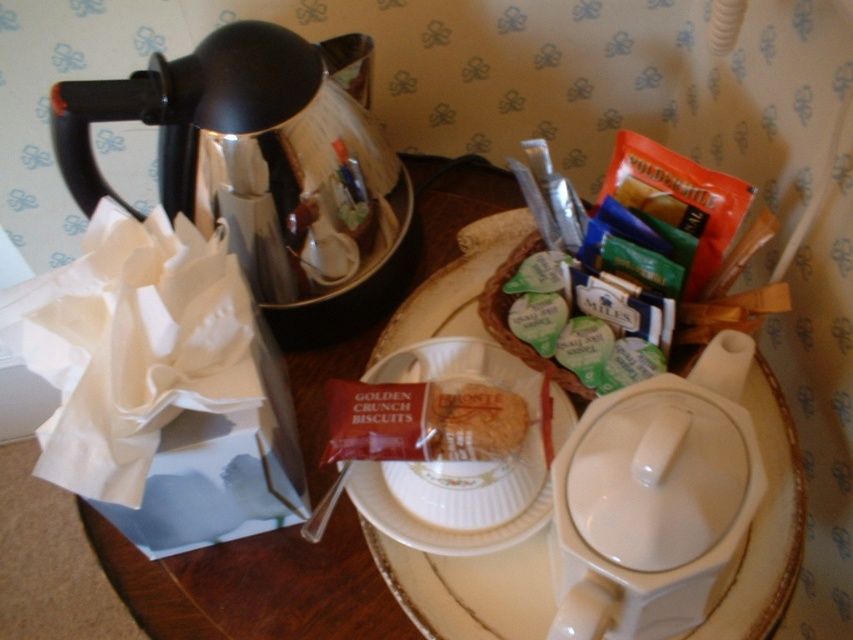
Question: Which object is positioned closest to the metallic spoon at lower center?

Choices:
 (A) white ceramic table at center
 (B) shiny metallic coffee pot at left
 (C) golden crunchy biscuit at center
 (D) white ceramic saucer at center

Answer: (C)

Question: Does white ceramic saucer at center appear on the left side of metallic spoon at lower center?

Choices:
 (A) yes
 (B) no

Answer: (B)

Question: Which object is positioned farthest from the white ceramic table at center?

Choices:
 (A) shiny metallic coffee pot at left
 (B) white ceramic saucer at center
 (C) metallic spoon at lower center
 (D) golden crunchy biscuit at center

Answer: (D)

Question: Among these objects, which one is farthest from the camera?

Choices:
 (A) white ceramic saucer at center
 (B) white ceramic table at center

Answer: (B)

Question: From the image, what is the correct spatial relationship of white ceramic table at center in relation to white ceramic saucer at center?

Choices:
 (A) below
 (B) above

Answer: (B)

Question: Does shiny metallic coffee pot at left appear over metallic spoon at lower center?

Choices:
 (A) no
 (B) yes

Answer: (B)